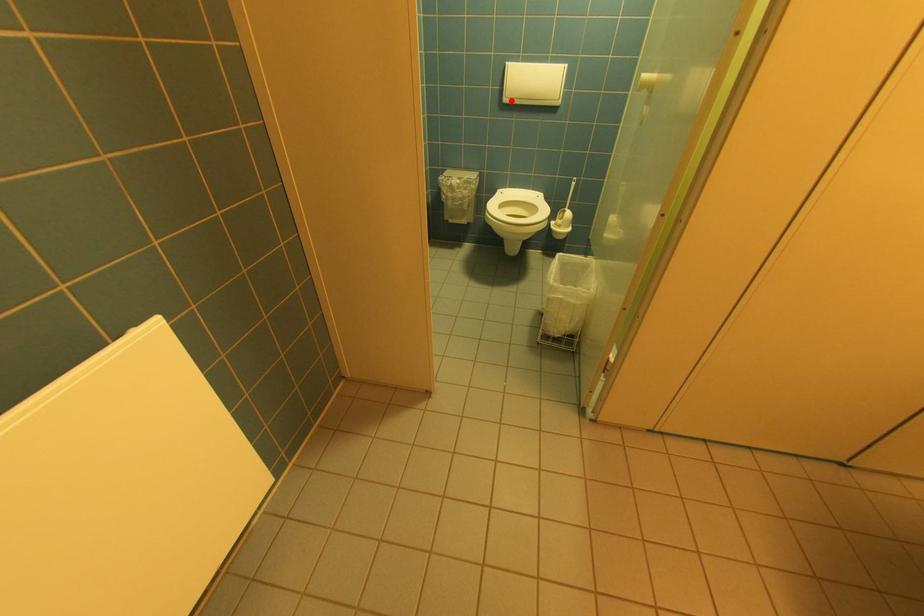
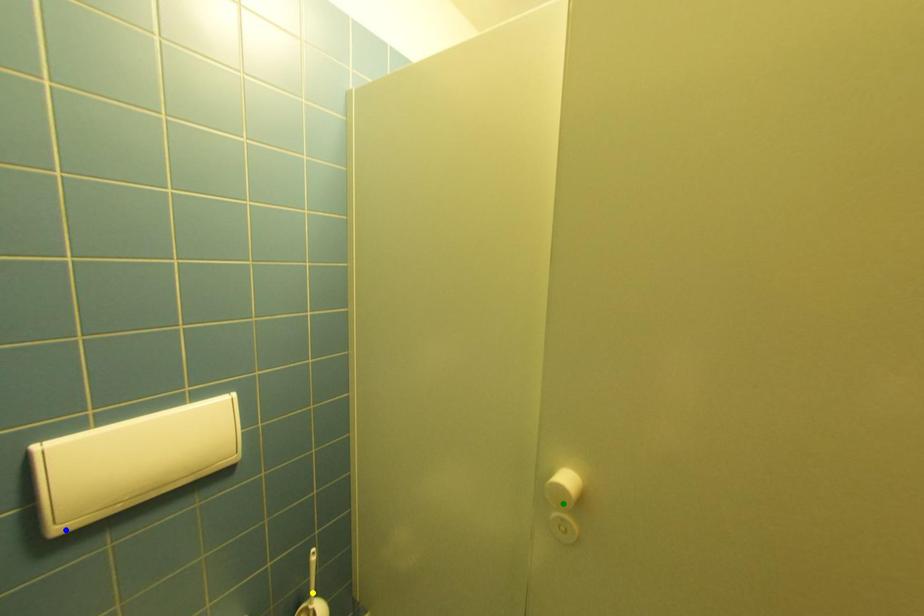
Question: I am providing you with two images of the same scene from different viewpoints. A red point is marked on the first image. You are given multiple points on the second image. In image 2, which mark is for the same physical point as the one in image 1?

Choices:
 (A) blue point
 (B) green point
 (C) yellow point

Answer: (A)